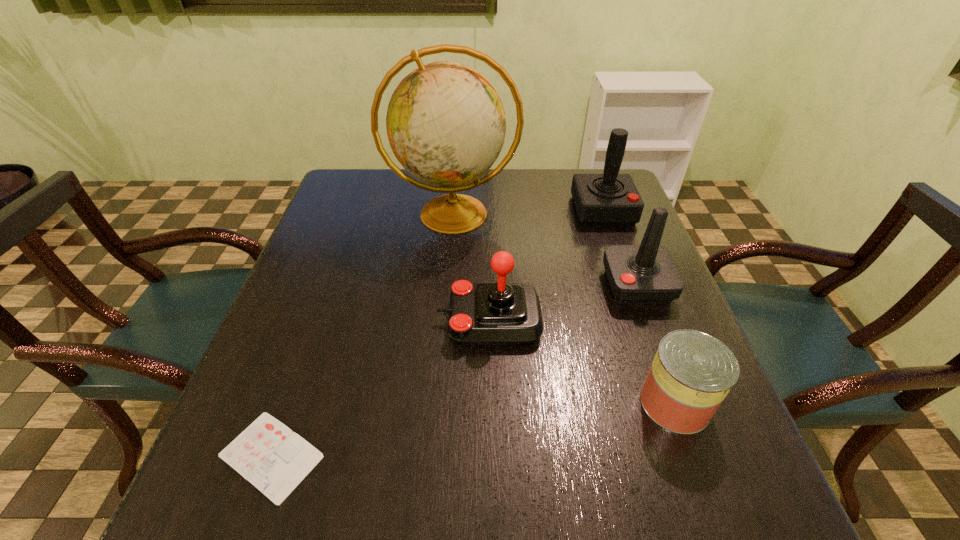
Where is `free space between the farthest joystick and the leftmost joystick`? This screenshot has width=960, height=540. free space between the farthest joystick and the leftmost joystick is located at coordinates (546, 265).

Where is `object that is the third closest to the second shortest object`? The width and height of the screenshot is (960, 540). object that is the third closest to the second shortest object is located at coordinates (446, 125).

Find the location of a particular element. object that is the third closest to the leftmost joystick is located at coordinates (692, 372).

This screenshot has height=540, width=960. Identify the location of joystick that is the second nearest to the shortest object. (646, 274).

Where is `joystick object that ranks as the second closest to the shortest object`? The width and height of the screenshot is (960, 540). joystick object that ranks as the second closest to the shortest object is located at coordinates (646, 274).

The height and width of the screenshot is (540, 960). In order to click on vacant space that satisfies the following two spatial constraints: 1. on the base of the farthest joystick; 2. on the base of the leftmost joystick in this screenshot , I will do `click(642, 320)`.

You are a GUI agent. You are given a task and a screenshot of the screen. Output one action in this format:
    pyautogui.click(x=<x>, y=<y>)
    Task: Click on the free region that satisfies the following two spatial constraints: 1. on the base of the can; 2. on the left side of the farthest joystick
    The image size is (960, 540).
    Given the screenshot: What is the action you would take?
    pyautogui.click(x=671, y=403)

The height and width of the screenshot is (540, 960). Identify the location of vacant position in the image that satisfies the following two spatial constraints: 1. on the base of the second shortest object; 2. on the left side of the leftmost joystick. (491, 403).